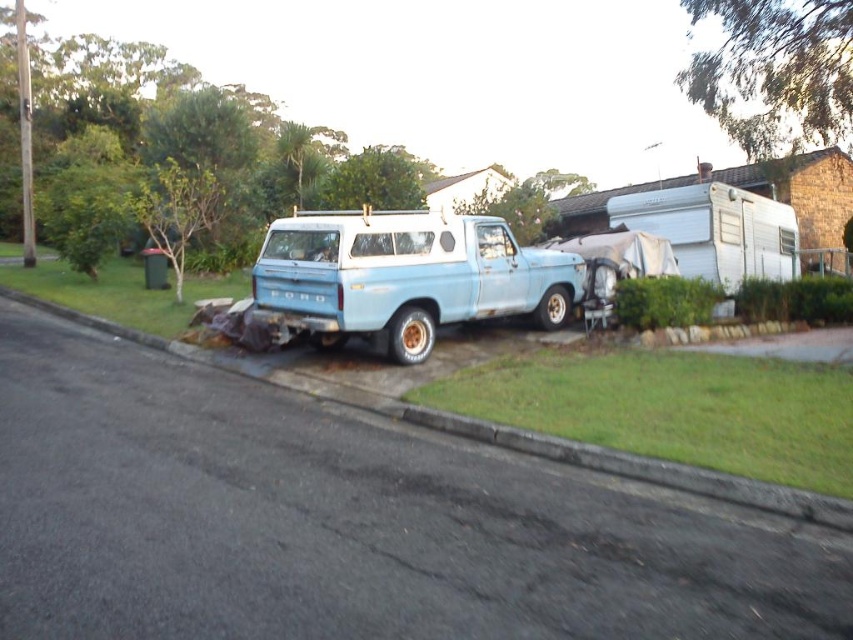
You are a delivery driver who needs to park your vehicle in this residential area. Your truck requires a minimum of 12 meters of space to safely turn around. Based on the scene, can you safely turn around in the space between the asphalt at lower center and the white matte camper at upper right?

The distance between asphalt at lower center and white matte camper at upper right is 10.88 meters. Since your truck needs at least 12 meters to turn around safely, the available space is insufficient. You should look for another area with more room.

You are standing in the driveway and want to walk to the white matte camper at upper right. Which direction should you move relative to the asphalt at lower center?

You should move away from the asphalt at lower center since the white matte camper at upper right is further away from you than the asphalt at lower center.